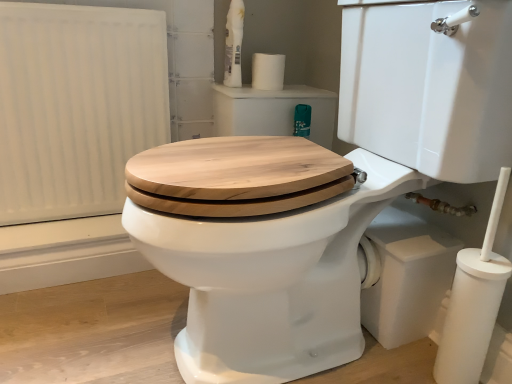
Question: Is white matte toilet paper at lower right in front of white glossy spray bottle at upper center?

Choices:
 (A) yes
 (B) no

Answer: (A)

Question: Does white matte toilet paper at lower right have a lesser width compared to white glossy spray bottle at upper center?

Choices:
 (A) yes
 (B) no

Answer: (A)

Question: From a real-world perspective, is white matte toilet paper at lower right over white glossy spray bottle at upper center?

Choices:
 (A) no
 (B) yes

Answer: (A)

Question: Is white matte toilet paper at lower right at the left side of white glossy spray bottle at upper center?

Choices:
 (A) no
 (B) yes

Answer: (A)

Question: Is white matte toilet paper at lower right with white glossy spray bottle at upper center?

Choices:
 (A) no
 (B) yes

Answer: (A)

Question: From the image's perspective, is white matte toilet paper at upper center above or below white matte radiator at left?

Choices:
 (A) below
 (B) above

Answer: (B)

Question: Is point click(x=271, y=56) positioned closer to the camera than point click(x=69, y=57)?

Choices:
 (A) farther
 (B) closer

Answer: (A)

Question: In terms of width, does white matte toilet paper at upper center look wider or thinner when compared to white matte radiator at left?

Choices:
 (A) wide
 (B) thin

Answer: (A)

Question: Choose the correct answer: Is white matte toilet paper at upper center inside white matte radiator at left or outside it?

Choices:
 (A) outside
 (B) inside

Answer: (A)

Question: From the image's perspective, is white matte radiator at left positioned above or below white matte toilet paper at upper center?

Choices:
 (A) above
 (B) below

Answer: (B)

Question: Looking at their shapes, would you say white matte radiator at left is wider or thinner than white matte toilet paper at upper center?

Choices:
 (A) thin
 (B) wide

Answer: (A)

Question: Based on their positions, is white matte radiator at left located to the left or right of white matte toilet paper at upper center?

Choices:
 (A) left
 (B) right

Answer: (A)

Question: Is white matte radiator at left in front of or behind white matte toilet paper at upper center in the image?

Choices:
 (A) behind
 (B) front

Answer: (B)

Question: Considering their positions, is white matte toilet paper at lower right located in front of or behind white matte toilet paper at upper center?

Choices:
 (A) behind
 (B) front

Answer: (B)

Question: From a real-world perspective, relative to white matte toilet paper at upper center, is white matte toilet paper at lower right vertically above or below?

Choices:
 (A) below
 (B) above

Answer: (A)